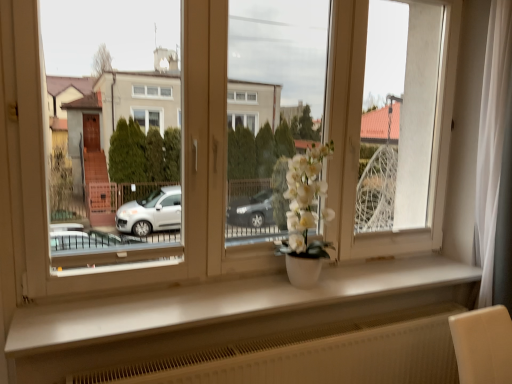
Find the location of a particular element. free spot below white matte vase at center (from a real-world perspective) is located at coordinates (303, 289).